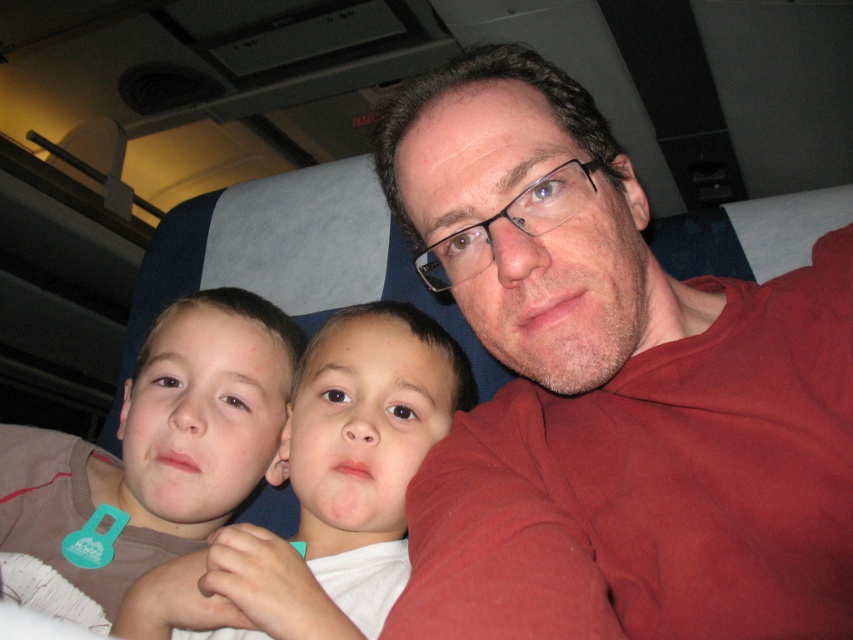
You are taking a selfie inside a train or airplane cabin. You want to ensure your phone is at a safe distance from the camera lens to avoid distortion. The point marked as point (801, 316) is where you want to place your phone. What is the minimum distance you should keep between your phone and the camera lens to avoid distortion?

The minimum distance you should keep between your phone and the camera lens is 21.39 inches to avoid distortion.

You are sitting in a seat on a train and see the matte red shirt at center and the brown cotton shirt at left. Which one is closer to the window?

The brown cotton shirt at left is closer to the window because it is positioned to the left of the matte red shirt at center, and in a typical train seating arrangement, the left side would be closer to the window.

You are sitting in a cabin with an overhead compartment. You notice a matte red shirt at center and a brown fabric shirt at left. Which shirt is closer to the camera?

The matte red shirt at center is closer to the camera because it is located above the brown fabric shirt at left.